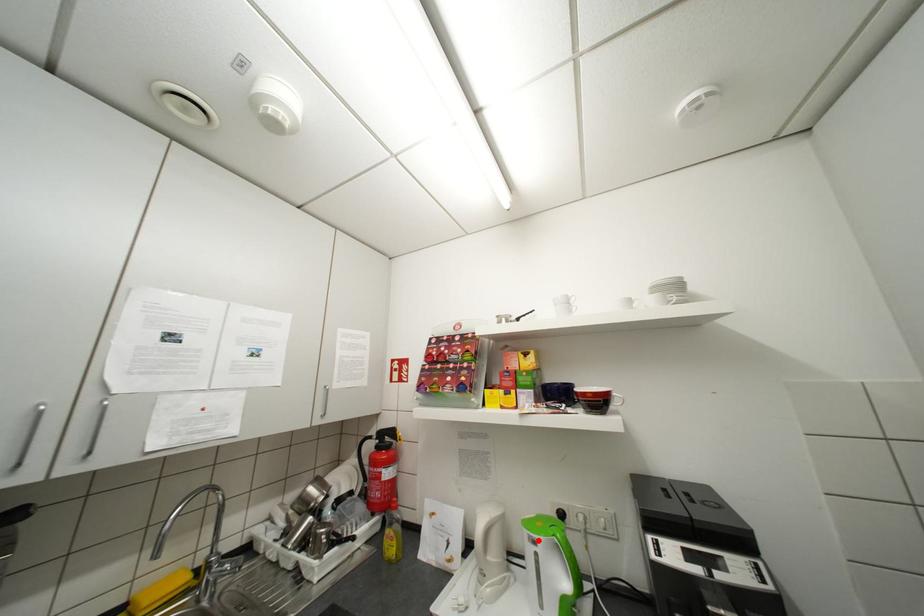
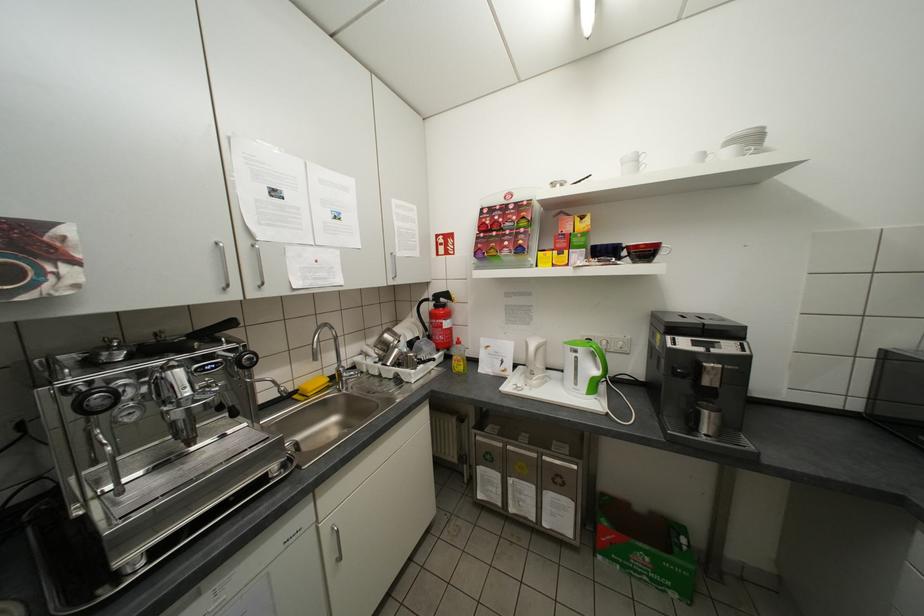
Find the pixel in the second image that matches the highlighted location in the first image.

(579, 351)